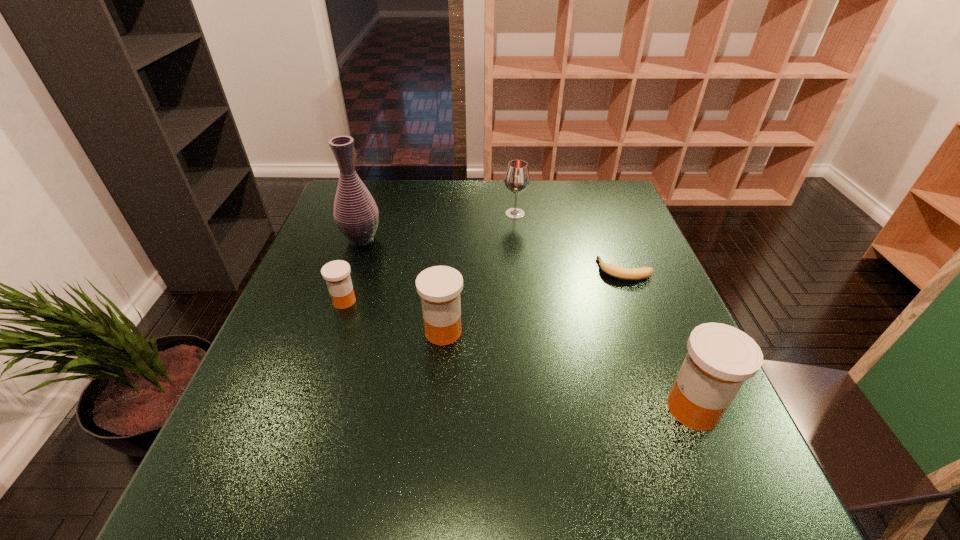
Where is `vase positioned at the left edge`? Image resolution: width=960 pixels, height=540 pixels. vase positioned at the left edge is located at coordinates (356, 214).

The width and height of the screenshot is (960, 540). I want to click on medicine present at the right edge, so click(x=720, y=358).

At what (x,y) coordinates should I click in order to perform the action: click on banana present at the right edge. Please return your answer as a coordinate pair (x, y). Looking at the image, I should click on tap(615, 271).

At what (x,y) coordinates should I click in order to perform the action: click on object present at the near right corner. Please return your answer as a coordinate pair (x, y). The image size is (960, 540). Looking at the image, I should click on [x=720, y=358].

Locate an element on the screen. blank area at the far edge is located at coordinates (390, 210).

In order to click on free space at the left edge of the desktop in this screenshot , I will do `click(318, 234)`.

You are a GUI agent. You are given a task and a screenshot of the screen. Output one action in this format:
    pyautogui.click(x=<x>, y=<y>)
    Task: Click on the vacant space at the right edge
    Image resolution: width=960 pixels, height=540 pixels.
    Given the screenshot: What is the action you would take?
    pyautogui.click(x=672, y=303)

Locate an element on the screen. The height and width of the screenshot is (540, 960). vacant region at the near left corner of the desktop is located at coordinates (252, 413).

This screenshot has height=540, width=960. In the image, there is a desktop. Identify the location of vacant space at the far right corner. pos(580,214).

Identify the location of free space between the banana and the leftmost medicine. The image size is (960, 540). (485, 286).